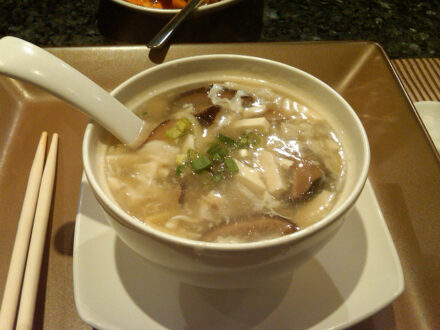
You are a GUI agent. You are given a task and a screenshot of the screen. Output one action in this format:
    pyautogui.click(x=<x>, y=<y>)
    Task: Click on the chopsticks
    
    Given the screenshot: What is the action you would take?
    pyautogui.click(x=21, y=217)